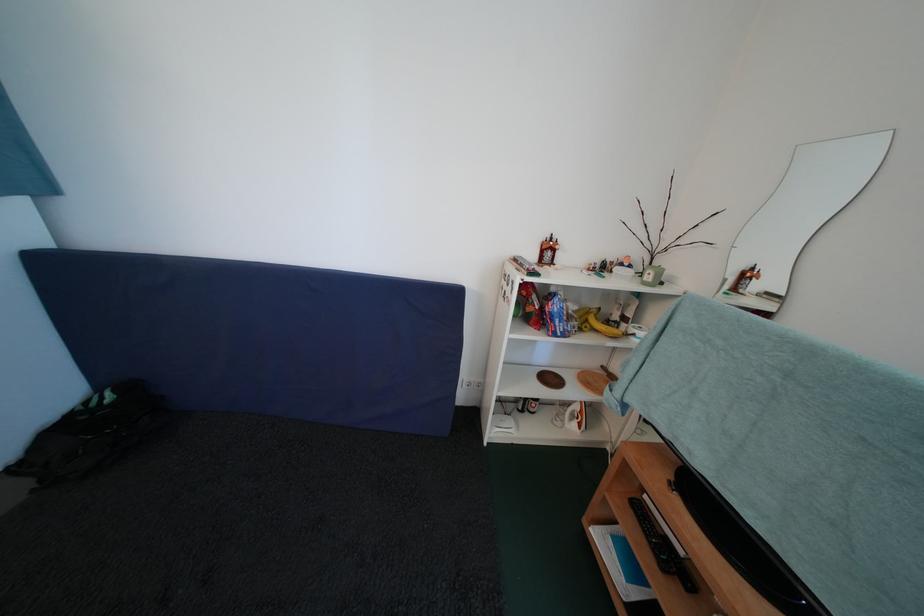
The image size is (924, 616). I want to click on white mug handle, so click(x=575, y=416).